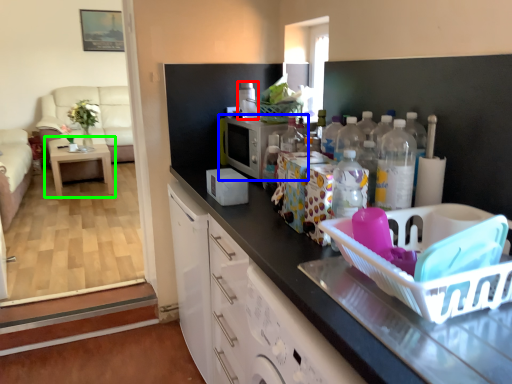
Question: Estimate the real-world distances between objects in this image. Which object is closer to appliance (highlighted by a red box), appliance (highlighted by a blue box) or table (highlighted by a green box)?

Choices:
 (A) appliance
 (B) table

Answer: (A)